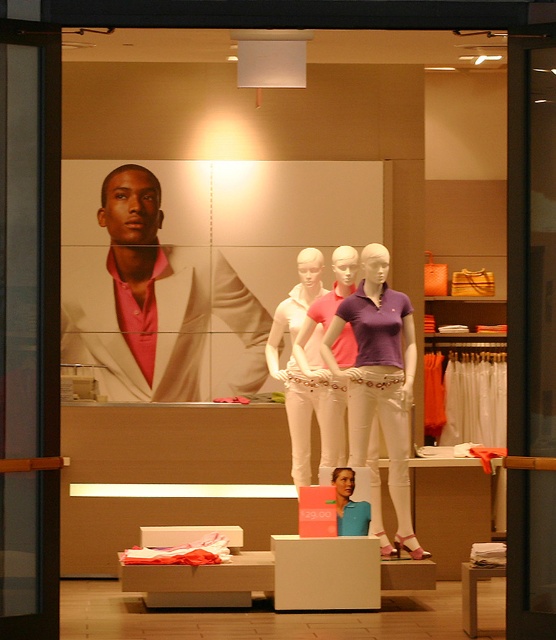
Is point (356, 330) positioned behind point (334, 388)?

That is False.

Between purple cotton polo shirt at center and matte white mannequin at center, which one has more height?

Standing taller between the two is purple cotton polo shirt at center.

Measure the distance between point (386, 328) and camera.

Point (386, 328) is 9.47 meters away from camera.

Identify the location of purple cotton polo shirt at center. This screenshot has height=640, width=556. (379, 378).

Can you confirm if matte white suit at center is wider than matte white mannequin at center?

Yes, matte white suit at center is wider than matte white mannequin at center.

Where is `matte white suit at center`? This screenshot has width=556, height=640. matte white suit at center is located at coordinates (153, 301).

Who is shorter, matte white suit at center or white matte pants at center?

With less height is white matte pants at center.

Is matte white suit at center bigger than white matte pants at center?

Yes.

What do you see at coordinates (153, 301) in the screenshot? This screenshot has width=556, height=640. I see `matte white suit at center` at bounding box center [153, 301].

This screenshot has height=640, width=556. What are the coordinates of `matte white suit at center` in the screenshot? It's located at (153, 301).